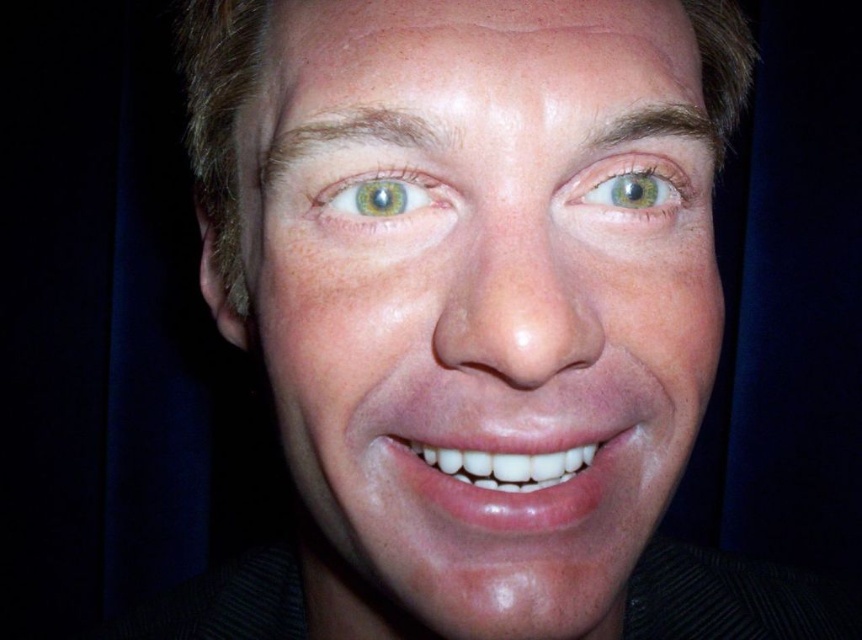
Can you confirm if smooth skin face at center is taller than green matte eye at center?

Indeed, smooth skin face at center has a greater height compared to green matte eye at center.

Does point (336, 163) come in front of point (317, 204)?

Yes, point (336, 163) is closer to viewer.

What are the coordinates of `smooth skin face at center` in the screenshot? It's located at (478, 305).

This screenshot has width=862, height=640. Identify the location of smooth skin face at center. (478, 305).

Can you confirm if smooth skin face at center is positioned to the right of glossy white teeth at center?

Incorrect, smooth skin face at center is not on the right side of glossy white teeth at center.

Which is in front, point (682, 449) or point (392, 452)?

Positioned in front is point (392, 452).

Find the location of a particular element. The width and height of the screenshot is (862, 640). smooth skin face at center is located at coordinates (478, 305).

Which of these two, glossy white teeth at center or green matte eye at center, stands taller?

With more height is glossy white teeth at center.

Is point (579, 502) positioned behind point (432, 184)?

Yes, point (579, 502) is farther from viewer.

Does point (498, 508) come behind point (415, 202)?

No, (498, 508) is in front of (415, 202).

Image resolution: width=862 pixels, height=640 pixels. I want to click on glossy white teeth at center, so click(507, 476).